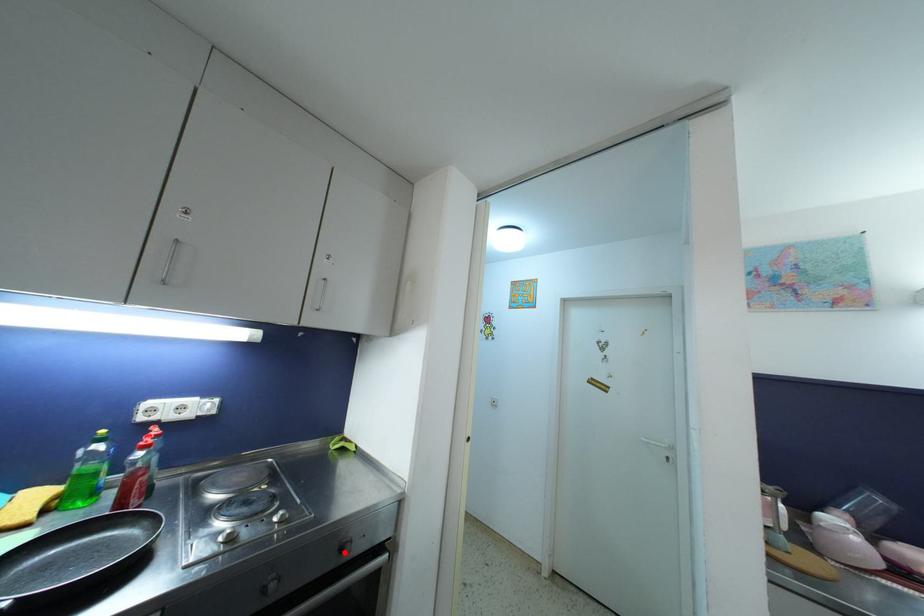
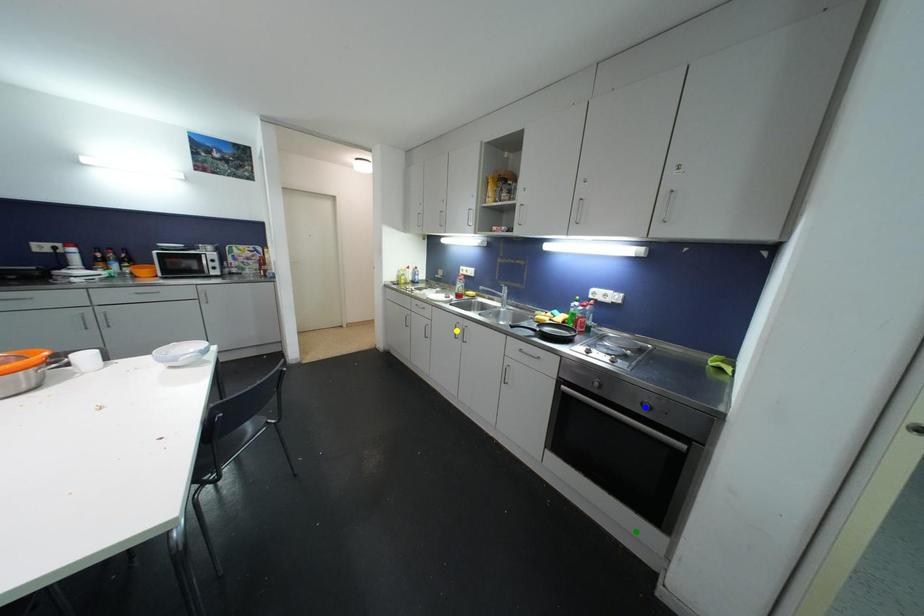
Question: I am providing you with two images of the same scene from different viewpoints. A red point is marked on the first image. You are given multiple points on the second image. Which mark in image 2 goes with the point in image 1?

Choices:
 (A) yellow point
 (B) green point
 (C) blue point

Answer: (C)